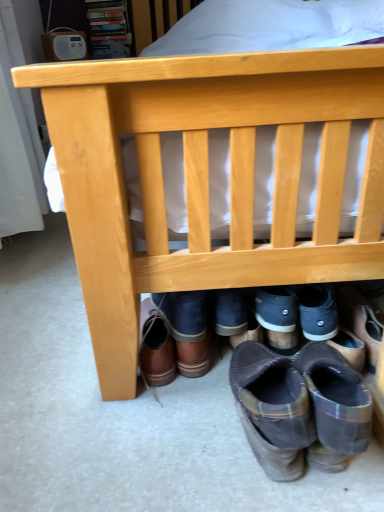
Question: Is brown leather boots at lower center, which appears as the 2th footwear when viewed from the left, a part of brown suede boot at lower right?

Choices:
 (A) yes
 (B) no

Answer: (B)

Question: Is brown suede boot at lower right to the right of brown leather boots at lower center, which ranks as the 3th footwear in right-to-left order, from the viewer's perspective?

Choices:
 (A) yes
 (B) no

Answer: (A)

Question: Is brown suede boot at lower right closer to the viewer compared to brown leather boots at lower center, which ranks as the 3th footwear in right-to-left order?

Choices:
 (A) yes
 (B) no

Answer: (A)

Question: Considering the relative sizes of brown suede boot at lower right and brown leather boots at lower center, which appears as the 2th footwear when viewed from the left, in the image provided, is brown suede boot at lower right wider than brown leather boots at lower center, which appears as the 2th footwear when viewed from the left,?

Choices:
 (A) no
 (B) yes

Answer: (B)

Question: From the image's perspective, would you say brown suede boot at lower right is positioned over brown leather boots at lower center, which ranks as the 3th footwear in right-to-left order?

Choices:
 (A) no
 (B) yes

Answer: (A)

Question: From the image's perspective, is brown leather boots at lower center, which ranks as the 3th footwear in right-to-left order, positioned above or below brown suede boot at lower right?

Choices:
 (A) below
 (B) above

Answer: (B)

Question: Considering the relative positions of brown leather boots at lower center, which ranks as the 3th footwear in right-to-left order, and brown suede boot at lower right in the image provided, is brown leather boots at lower center, which ranks as the 3th footwear in right-to-left order, to the left or to the right of brown suede boot at lower right?

Choices:
 (A) left
 (B) right

Answer: (A)

Question: In the image, is brown leather boots at lower center, which ranks as the 3th footwear in right-to-left order, positioned in front of or behind brown suede boot at lower right?

Choices:
 (A) behind
 (B) front

Answer: (A)

Question: Considering the positions of point (195, 298) and point (332, 352), is point (195, 298) closer or farther from the camera than point (332, 352)?

Choices:
 (A) closer
 (B) farther

Answer: (B)

Question: Is brown suede boot at lower right taller or shorter than brown leather boots at lower center, which appears as the 2th footwear when viewed from the left?

Choices:
 (A) short
 (B) tall

Answer: (A)

Question: Is brown suede boot at lower right wider or thinner than brown leather boots at lower center, which appears as the 2th footwear when viewed from the left?

Choices:
 (A) wide
 (B) thin

Answer: (A)

Question: Is brown suede boot at lower right to the left or to the right of brown leather boots at lower center, which ranks as the 3th footwear in right-to-left order, in the image?

Choices:
 (A) right
 (B) left

Answer: (A)

Question: Based on their sizes in the image, would you say brown suede boot at lower right is bigger or smaller than brown leather boots at lower center, which ranks as the 3th footwear in right-to-left order?

Choices:
 (A) big
 (B) small

Answer: (B)

Question: In terms of size, does brown leather boots at lower center, positioned as the third footwear in left-to-right order, appear bigger or smaller than dark gray suede boot at center, acting as the fourth footwear starting from the left?

Choices:
 (A) big
 (B) small

Answer: (A)

Question: From the image's perspective, relative to dark gray suede boot at center, acting as the fourth footwear starting from the left, is brown leather boots at lower center, positioned as the third footwear in left-to-right order, above or below?

Choices:
 (A) above
 (B) below

Answer: (B)